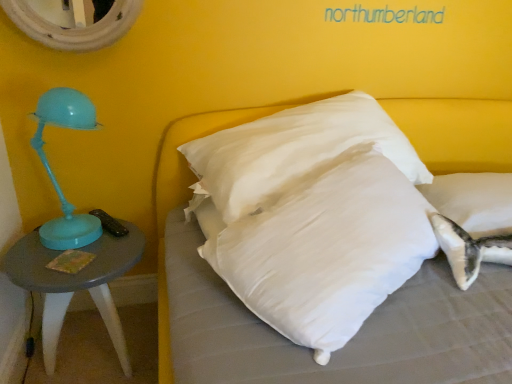
Image resolution: width=512 pixels, height=384 pixels. In order to click on vacant area on top of matte gray table at left (from a real-world perspective) in this screenshot , I will do `click(91, 243)`.